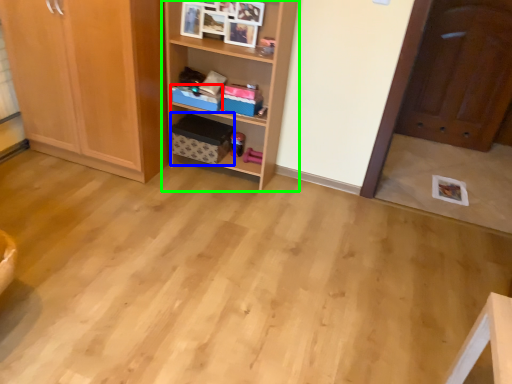
Question: Which is farther away from storage box (highlighted by a red box)? cardboard box (highlighted by a blue box) or shelf (highlighted by a green box)?

Choices:
 (A) cardboard box
 (B) shelf

Answer: (B)